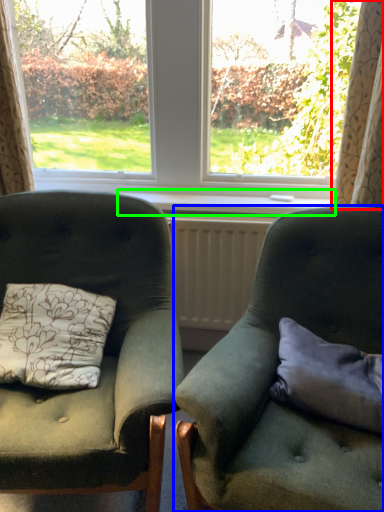
Question: Which object is the closest to the curtain (highlighted by a red box)? Choose among these: chair (highlighted by a blue box) or window sill (highlighted by a green box).

Choices:
 (A) chair
 (B) window sill

Answer: (B)